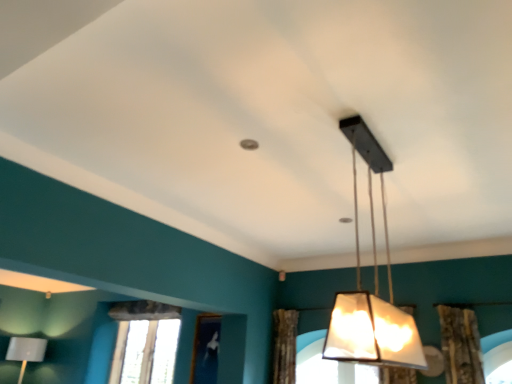
Based on the photo, in order to face matte gray lampshade at lower left, arranged as the first lamp when ordered from the bottom, should I rotate leftwards or rightwards?

To face it directly, rotate left by 28.825 degrees.

The width and height of the screenshot is (512, 384). Describe the element at coordinates (285, 346) in the screenshot. I see `brown textured curtain at center` at that location.

This screenshot has width=512, height=384. What are the coordinates of `matte gray lampshade at lower left, which is the 1th lamp from back to front` in the screenshot? It's located at (26, 351).

Which object is closer to the camera taking this photo, clear glass window at lower left or brown textured curtain at center?

brown textured curtain at center is closer to the camera.

In the scene shown: Which is less distant, (140, 349) or (292, 337)?

Point (140, 349) is positioned closer to the camera compared to point (292, 337).

In order to click on curtain that appears in front of the clear glass window at lower left in this screenshot , I will do `click(285, 346)`.

From a real-world perspective, between clear glass window at lower left and brown textured curtain at center, who is vertically higher?

brown textured curtain at center.

Is the depth of clear glass window at lower left greater than that of matte gray lampshade at lower left, arranged as the first lamp when ordered from the bottom?

No, it is in front of matte gray lampshade at lower left, arranged as the first lamp when ordered from the bottom.

Are clear glass window at lower left and matte gray lampshade at lower left, positioned as the 2th lamp in front-to-back order, beside each other?

No, clear glass window at lower left is not making contact with matte gray lampshade at lower left, positioned as the 2th lamp in front-to-back order.

From the image's perspective, is clear glass window at lower left under matte gray lampshade at lower left, which is the 1th lamp from back to front?

No.

Is clear glass window at lower left outside of matte gray lampshade at lower left, positioned as the 2th lamp in front-to-back order?

clear glass window at lower left lies outside matte gray lampshade at lower left, positioned as the 2th lamp in front-to-back order,'s area.

How many degrees apart are the facing directions of matte black lampshade at center, the 1th lamp viewed from the front, and brown textured curtain at center?

matte black lampshade at center, the 1th lamp viewed from the front, and brown textured curtain at center are facing 94.1 degrees away from each other.

In the image, is matte black lampshade at center, acting as the first lamp starting from the top, positioned in front of or behind brown textured curtain at center?

matte black lampshade at center, acting as the first lamp starting from the top, is positioned closer to the viewer than brown textured curtain at center.

Is matte black lampshade at center, the 2th lamp in the back-to-front sequence, inside or outside of brown textured curtain at center?

matte black lampshade at center, the 2th lamp in the back-to-front sequence, is outside brown textured curtain at center.

Which of these two, matte black lampshade at center, which is the first lamp in right-to-left order, or brown textured curtain at center, is wider?

With larger width is brown textured curtain at center.

Image resolution: width=512 pixels, height=384 pixels. In order to click on window lying in front of the matte gray lampshade at lower left, arranged as the first lamp when ordered from the bottom in this screenshot , I will do `click(145, 342)`.

Considering the sizes of matte gray lampshade at lower left, which is the 1th lamp from back to front, and clear glass window at lower left in the image, is matte gray lampshade at lower left, which is the 1th lamp from back to front, bigger or smaller than clear glass window at lower left?

In the image, matte gray lampshade at lower left, which is the 1th lamp from back to front, appears to be larger than clear glass window at lower left.

What's the angular difference between matte gray lampshade at lower left, which is the 1th lamp from back to front, and clear glass window at lower left's facing directions?

86.8 degrees.

Which is more to the left, matte gray lampshade at lower left, arranged as the first lamp when ordered from the bottom, or clear glass window at lower left?

Positioned to the left is matte gray lampshade at lower left, arranged as the first lamp when ordered from the bottom.

Is brown textured curtain at center oriented towards matte gray lampshade at lower left, placed as the second lamp when sorted from top to bottom?

No, brown textured curtain at center does not turn towards matte gray lampshade at lower left, placed as the second lamp when sorted from top to bottom.

Looking at their sizes, would you say brown textured curtain at center is wider or thinner than matte gray lampshade at lower left, which is the second lamp from right to left?

brown textured curtain at center is thinner than matte gray lampshade at lower left, which is the second lamp from right to left.

How different are the orientations of brown textured curtain at center and matte gray lampshade at lower left, which ranks as the 1th lamp in left-to-right order, in degrees?

There is a 89.1-degree angle between the facing directions of brown textured curtain at center and matte gray lampshade at lower left, which ranks as the 1th lamp in left-to-right order.

Measure the distance between brown textured curtain at center and matte gray lampshade at lower left, which is the second lamp from right to left.

The distance of brown textured curtain at center from matte gray lampshade at lower left, which is the second lamp from right to left, is 7.49 feet.

Can you confirm if brown textured curtain at center is thinner than clear glass window at lower left?

Incorrect, the width of brown textured curtain at center is not less than that of clear glass window at lower left.

From the picture: Is brown textured curtain at center positioned with its back to clear glass window at lower left?

brown textured curtain at center does not have its back to clear glass window at lower left.

Is brown textured curtain at center at the right side of clear glass window at lower left?

Correct, you'll find brown textured curtain at center to the right of clear glass window at lower left.

Considering the relative sizes of brown textured curtain at center and clear glass window at lower left in the image provided, is brown textured curtain at center smaller than clear glass window at lower left?

Indeed, brown textured curtain at center has a smaller size compared to clear glass window at lower left.

Is matte gray lampshade at lower left, which ranks as the 1th lamp in left-to-right order, positioned with its back to matte black lampshade at center, which is the first lamp in right-to-left order?

matte gray lampshade at lower left, which ranks as the 1th lamp in left-to-right order, is not turned away from matte black lampshade at center, which is the first lamp in right-to-left order.

Looking at this image, looking at their sizes, would you say matte gray lampshade at lower left, arranged as the first lamp when ordered from the bottom, is wider or thinner than matte black lampshade at center, the 2th lamp from the left?

Considering their sizes, matte gray lampshade at lower left, arranged as the first lamp when ordered from the bottom, looks broader than matte black lampshade at center, the 2th lamp from the left.

Considering the points (24, 362) and (380, 341), which point is in front, point (24, 362) or point (380, 341)?

Point (380, 341)

Find the location of a particular element. The height and width of the screenshot is (384, 512). curtain above the clear glass window at lower left (from a real-world perspective) is located at coordinates (285, 346).

What are the coordinates of `lamp behind the clear glass window at lower left` in the screenshot? It's located at (26, 351).

When comparing their distances from matte black lampshade at center, the 2th lamp in the back-to-front sequence, does clear glass window at lower left or brown textured curtain at center seem further?

The object further to matte black lampshade at center, the 2th lamp in the back-to-front sequence, is clear glass window at lower left.

Estimate the real-world distances between objects in this image. Which object is further from matte black lampshade at center, which is the first lamp in right-to-left order, brown textured curtain at center or clear glass window at lower left?

clear glass window at lower left is further to matte black lampshade at center, which is the first lamp in right-to-left order.

Estimate the real-world distances between objects in this image. Which object is closer to matte gray lampshade at lower left, positioned as the 2th lamp in front-to-back order, matte black lampshade at center, which is the first lamp in right-to-left order, or clear glass window at lower left?

clear glass window at lower left is positioned closer to the anchor matte gray lampshade at lower left, positioned as the 2th lamp in front-to-back order.

Estimate the real-world distances between objects in this image. Which object is further from clear glass window at lower left, matte black lampshade at center, the 2th lamp in the back-to-front sequence, or brown textured curtain at center?

Based on the image, matte black lampshade at center, the 2th lamp in the back-to-front sequence, appears to be further to clear glass window at lower left.

Considering their positions, is matte gray lampshade at lower left, which ranks as the 1th lamp in left-to-right order, positioned closer to brown textured curtain at center than clear glass window at lower left?

clear glass window at lower left is closer to brown textured curtain at center.

When comparing their distances from matte black lampshade at center, the 2th lamp from the left, does clear glass window at lower left or matte gray lampshade at lower left, which ranks as the 1th lamp in left-to-right order, seem closer?

Among the two, clear glass window at lower left is located nearer to matte black lampshade at center, the 2th lamp from the left.

Looking at the image, which one is located closer to brown textured curtain at center, matte black lampshade at center, the 2th lamp from the left, or clear glass window at lower left?

clear glass window at lower left is closer to brown textured curtain at center.

Estimate the real-world distances between objects in this image. Which object is further from matte gray lampshade at lower left, which is the 1th lamp from back to front, clear glass window at lower left or brown textured curtain at center?

Based on the image, brown textured curtain at center appears to be further to matte gray lampshade at lower left, which is the 1th lamp from back to front.

This screenshot has height=384, width=512. Find the location of `curtain between matte gray lampshade at lower left, placed as the second lamp when sorted from top to bottom, and matte black lampshade at center, which is the first lamp in right-to-left order`. curtain between matte gray lampshade at lower left, placed as the second lamp when sorted from top to bottom, and matte black lampshade at center, which is the first lamp in right-to-left order is located at coordinates (285, 346).

What are the coordinates of `curtain positioned between matte black lampshade at center, the 2th lamp from the left, and clear glass window at lower left from near to far` in the screenshot? It's located at (285, 346).

At what (x,y) coordinates should I click in order to perform the action: click on window positioned between matte black lampshade at center, the 2th lamp in the back-to-front sequence, and matte gray lampshade at lower left, which is the 1th lamp from back to front, from near to far. Please return your answer as a coordinate pair (x, y). The height and width of the screenshot is (384, 512). Looking at the image, I should click on (145, 342).

At what (x,y) coordinates should I click in order to perform the action: click on window between matte gray lampshade at lower left, which is the second lamp from right to left, and brown textured curtain at center. Please return your answer as a coordinate pair (x, y). This screenshot has width=512, height=384. Looking at the image, I should click on (145, 342).